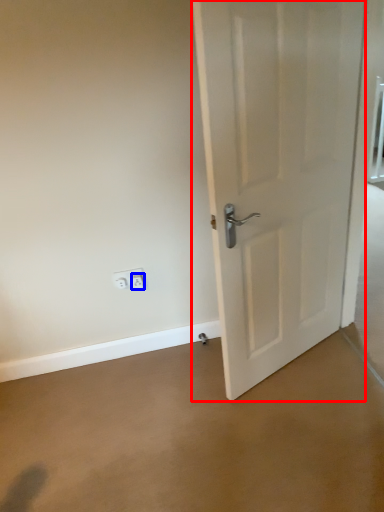
Question: Among these objects, which one is farthest to the camera, door (highlighted by a red box) or electric outlet (highlighted by a blue box)?

Choices:
 (A) door
 (B) electric outlet

Answer: (B)